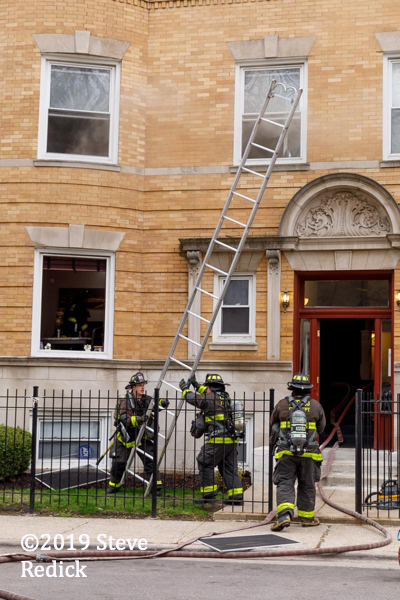
The image size is (400, 600). Identify the location of removed window screens. (241, 544), (65, 482).